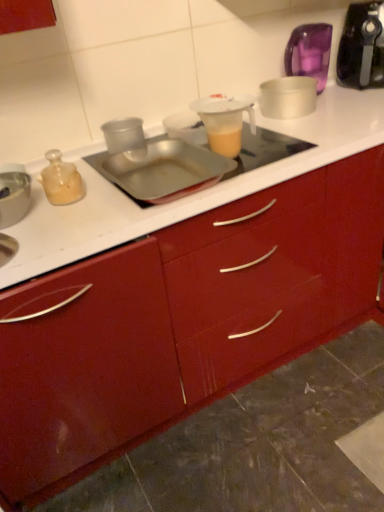
Image resolution: width=384 pixels, height=512 pixels. I want to click on free space to the right of metallic silver bowl at left, marked as the 4th appliance in a right-to-left arrangement, so click(x=70, y=221).